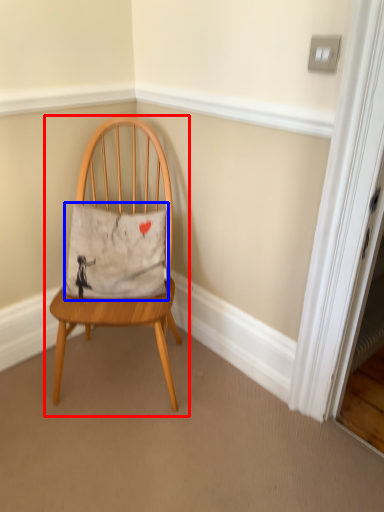
Question: Which object is closer to the camera taking this photo, chair (highlighted by a red box) or pillow (highlighted by a blue box)?

Choices:
 (A) chair
 (B) pillow

Answer: (A)